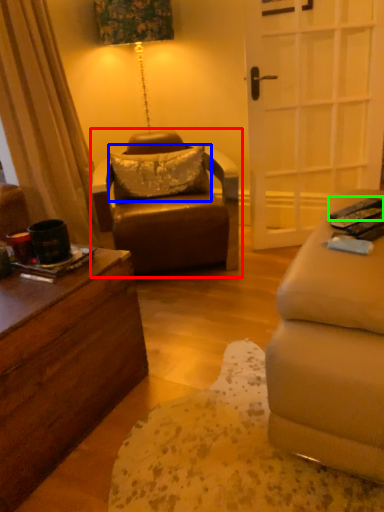
Question: Based on their relative distances, which object is farther from chair (highlighted by a red box)? Choose from pillow (highlighted by a blue box) and remote control (highlighted by a green box).

Choices:
 (A) pillow
 (B) remote control

Answer: (B)